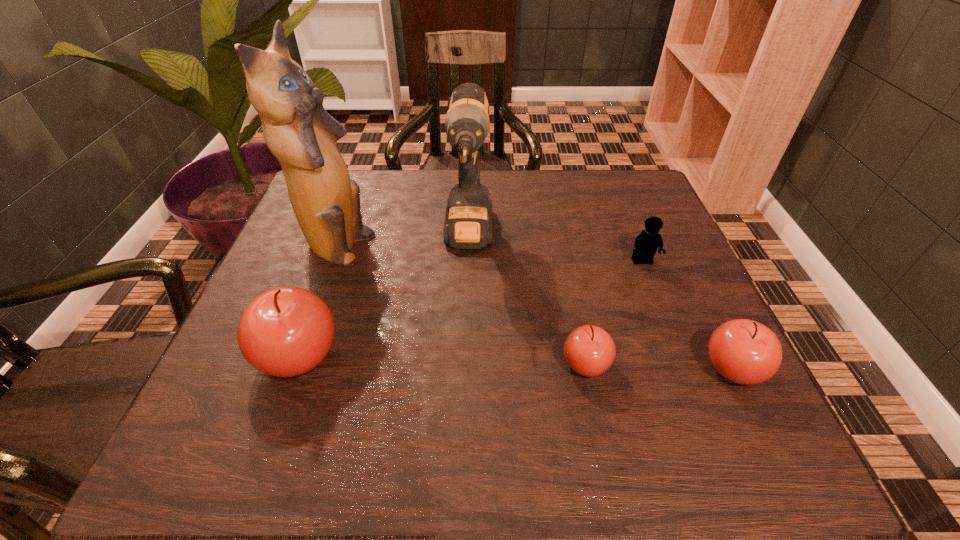
If equal spacing is the goal by inserting an additional apple among them, please point out a vacant space for this new apple. Please provide its 2D coordinates. Your answer should be formatted as a tuple, i.e. [(x, y)], where the tuple contains the x and y coordinates of a point satisfying the conditions above.

[(442, 360)]